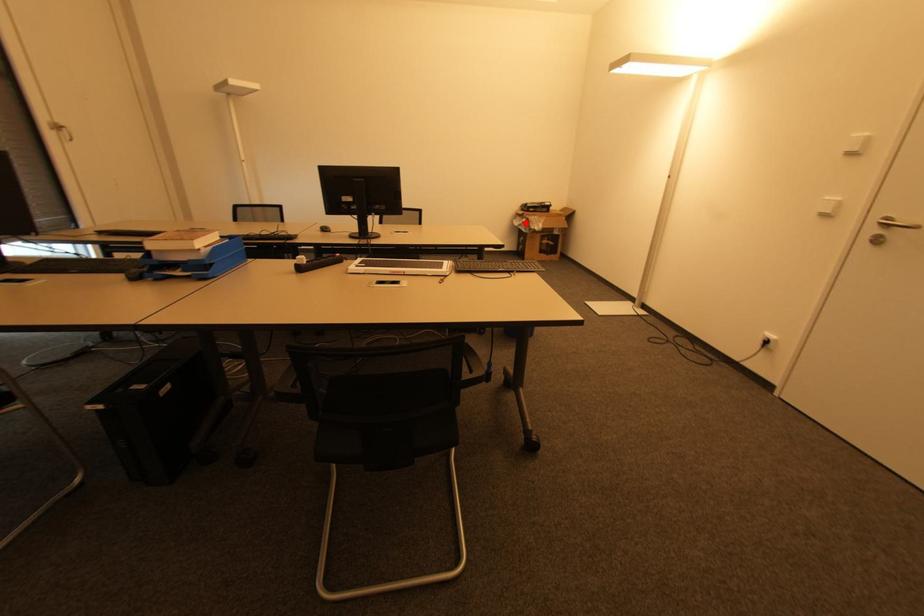
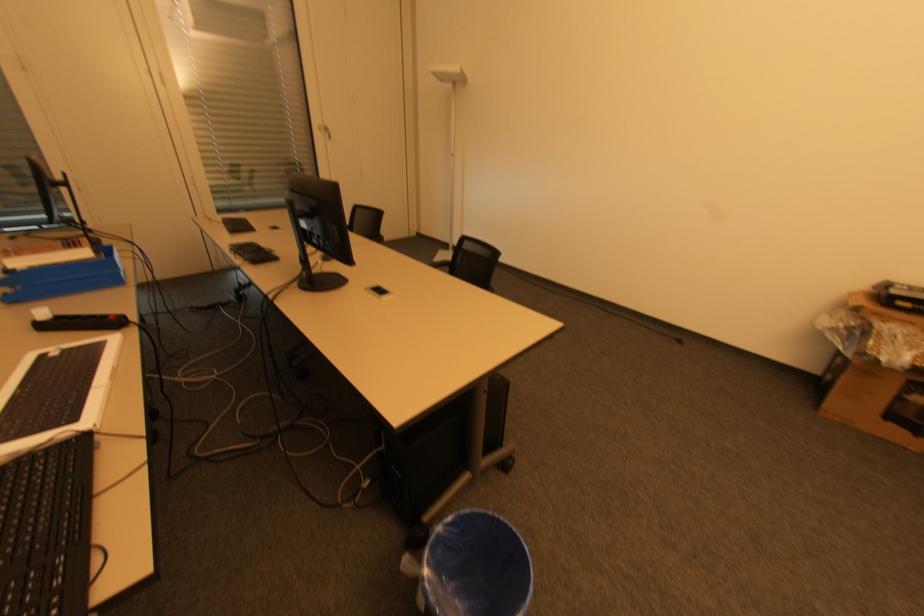
In the second image, find the point that corresponds to the highlighted location in the first image.

(850, 328)